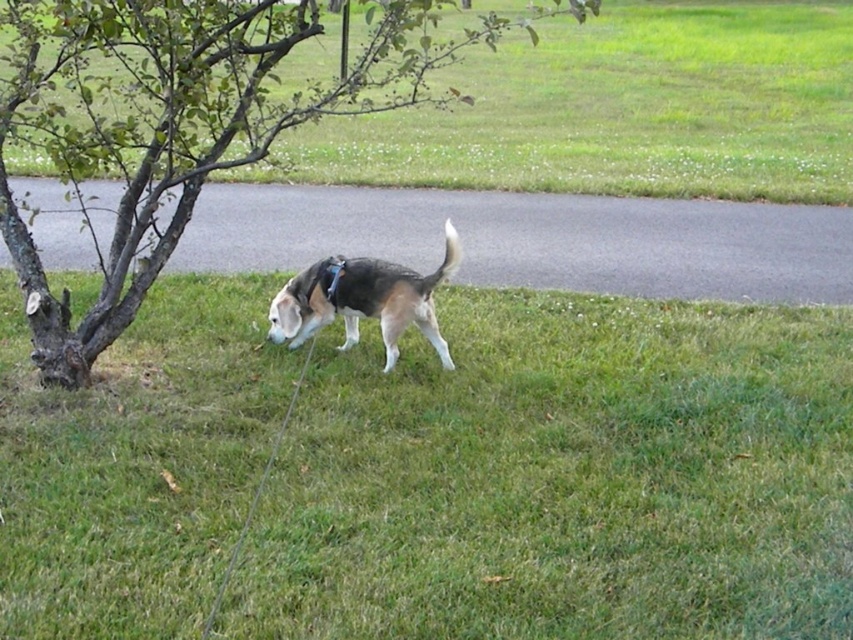
Question: Which of the following is the farthest from the observer?

Choices:
 (A) coord(351,84)
 (B) coord(215,291)
 (C) coord(350,275)

Answer: (B)

Question: Can you confirm if green grass at center is wider than brown bark tree at left?

Choices:
 (A) yes
 (B) no

Answer: (B)

Question: Which object is farther from the camera taking this photo?

Choices:
 (A) brown and white fur dog at center
 (B) brown bark tree at left

Answer: (A)

Question: Does green grass at center appear under brown and white fur dog at center?

Choices:
 (A) yes
 (B) no

Answer: (A)

Question: Which is nearer to the brown and white fur dog at center?

Choices:
 (A) brown bark tree at left
 (B) green grass at center

Answer: (B)

Question: Is green grass at center above brown bark tree at left?

Choices:
 (A) yes
 (B) no

Answer: (B)